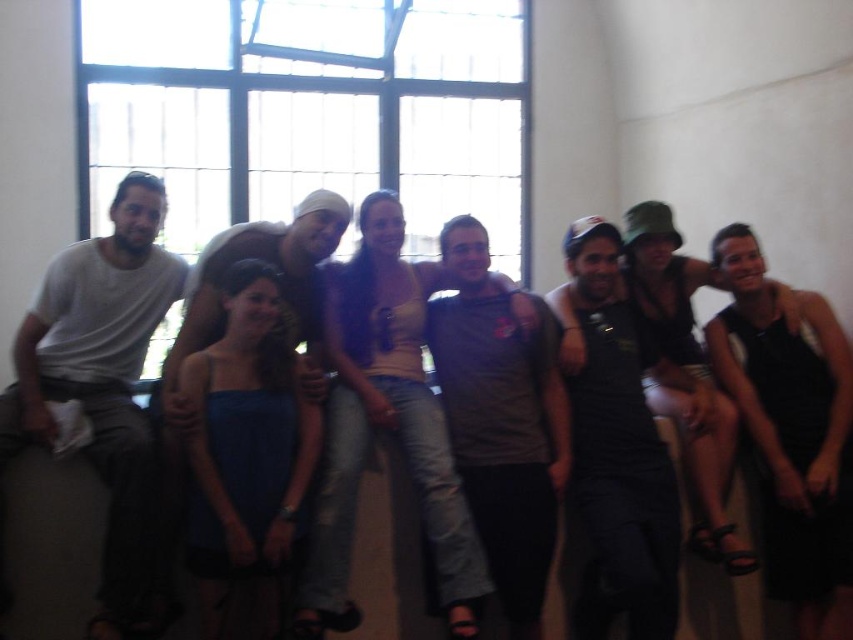
Question: Considering the real-world distances, which object is farthest from the clear glass window at upper center?

Choices:
 (A) gray matte t-shirt at center
 (B) white cotton t-shirt at left
 (C) black matte tank top at center
 (D) matte brown shirt at center

Answer: (C)

Question: Is white cotton t-shirt at left positioned at the back of matte brown shirt at center?

Choices:
 (A) no
 (B) yes

Answer: (A)

Question: Considering the relative positions of white cotton t-shirt at left and matte brown shirt at center in the image provided, where is white cotton t-shirt at left located with respect to matte brown shirt at center?

Choices:
 (A) above
 (B) below

Answer: (B)

Question: Estimate the real-world distances between objects in this image. Which object is farther from the matte brown shirt at center?

Choices:
 (A) white cotton t-shirt at left
 (B) clear glass window at upper center
 (C) black matte tank top at center

Answer: (B)

Question: Where is white cotton t-shirt at left located in relation to matte brown shirt at center in the image?

Choices:
 (A) below
 (B) above

Answer: (A)

Question: Which of the following is the closest to the observer?

Choices:
 (A) gray matte t-shirt at center
 (B) black matte tank top at center
 (C) matte brown shirt at center
 (D) white cotton t-shirt at left

Answer: (D)